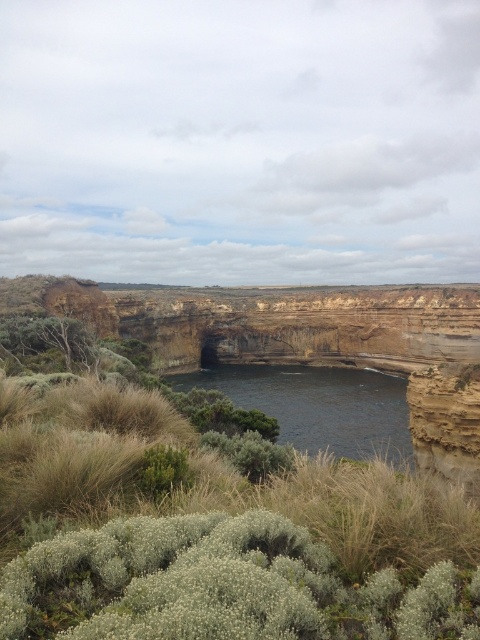
You are standing at the edge of the cliff looking out at the coastal landscape. There are two points marked on the cliff face. Can you determine which point is closer to you? The points are labeled as point (171, 596) and point (228, 374).

Point (171, 596) is closer to the viewer than point (228, 374).

You are standing at the edge of the cliff overlooking the green grassy shrubs at center. If you want to reach the shrubs without descending the cliff, which direction should you move relative to the shrubs?

Since the green grassy shrubs at center are 88.27 feet away from the viewer, you would need to move towards them along the cliff edge to reach them without descending.

You are standing at the edge of the cliff looking down. You see the green grassy shrubs at center and the dark blue water at center. Which one is closer to your feet?

The green grassy shrubs at center are closer to your feet since they are positioned over the dark blue water at center.